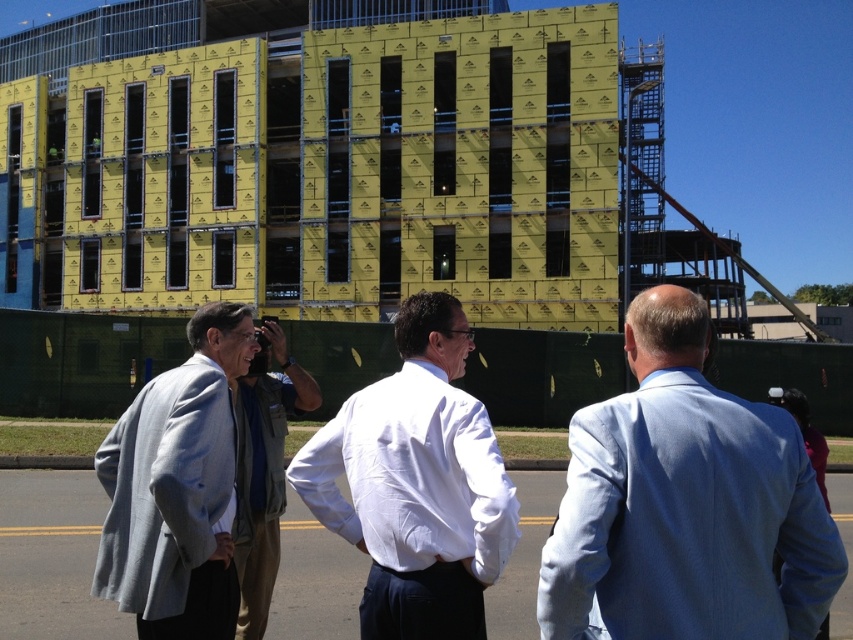
Question: Does gray woolen sweater at left come in front of light gray fabric jacket at center?

Choices:
 (A) no
 (B) yes

Answer: (B)

Question: Is light blue suit at center bigger than light gray fabric jacket at center?

Choices:
 (A) no
 (B) yes

Answer: (A)

Question: Is the position of gray woolen sweater at left less distant than that of light gray fabric jacket at center?

Choices:
 (A) no
 (B) yes

Answer: (B)

Question: Which of the following is the closest to the observer?

Choices:
 (A) gray woolen sweater at left
 (B) light gray fabric jacket at center
 (C) white smooth shirt at center

Answer: (C)

Question: Which object is farther from the camera taking this photo?

Choices:
 (A) light blue suit at center
 (B) light gray fabric jacket at center

Answer: (B)

Question: Among these points, which one is nearest to the camera?

Choices:
 (A) (267, 476)
 (B) (699, 426)
 (C) (424, 580)

Answer: (B)